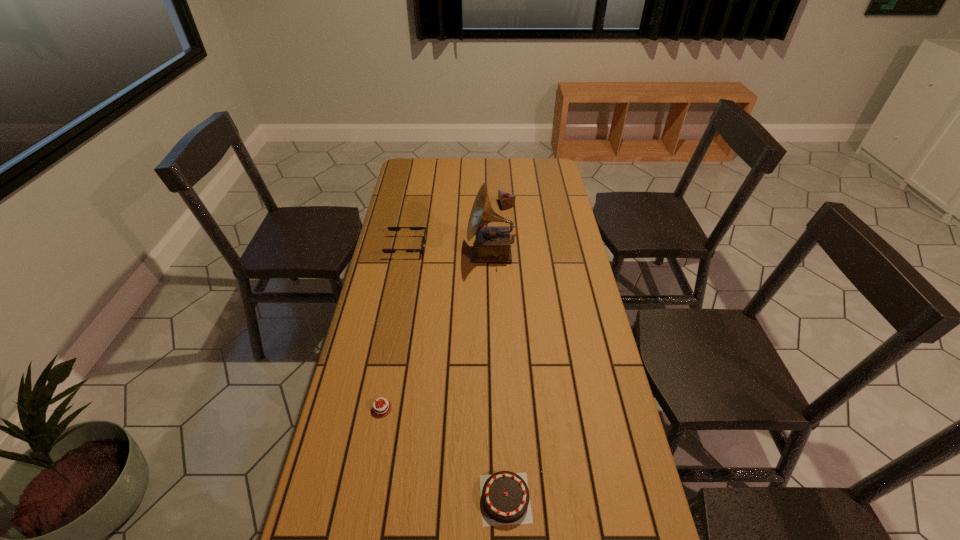
The height and width of the screenshot is (540, 960). Identify the location of phonograph record. (492, 244).

This screenshot has width=960, height=540. What are the coordinates of `the second tallest object` in the screenshot? It's located at (506, 200).

The width and height of the screenshot is (960, 540). I want to click on the farthest object, so click(506, 200).

Image resolution: width=960 pixels, height=540 pixels. I want to click on sunglasses, so click(x=389, y=228).

The height and width of the screenshot is (540, 960). I want to click on the nearest chocolate cake, so click(505, 500).

Image resolution: width=960 pixels, height=540 pixels. What are the coordinates of `the nearest object` in the screenshot? It's located at (505, 500).

You are a GUI agent. You are given a task and a screenshot of the screen. Output one action in this format:
    pyautogui.click(x=<x>, y=<y>)
    Task: Click on the shortest object
    
    Given the screenshot: What is the action you would take?
    pyautogui.click(x=379, y=408)

The width and height of the screenshot is (960, 540). I want to click on the shortest chocolate cake, so click(379, 408).

This screenshot has width=960, height=540. In order to click on vacant space located 0.180m on the horn of the phonograph record in this screenshot , I will do `click(420, 253)`.

The image size is (960, 540). Identify the location of free space located 0.170m on the horn of the phonograph record. (422, 253).